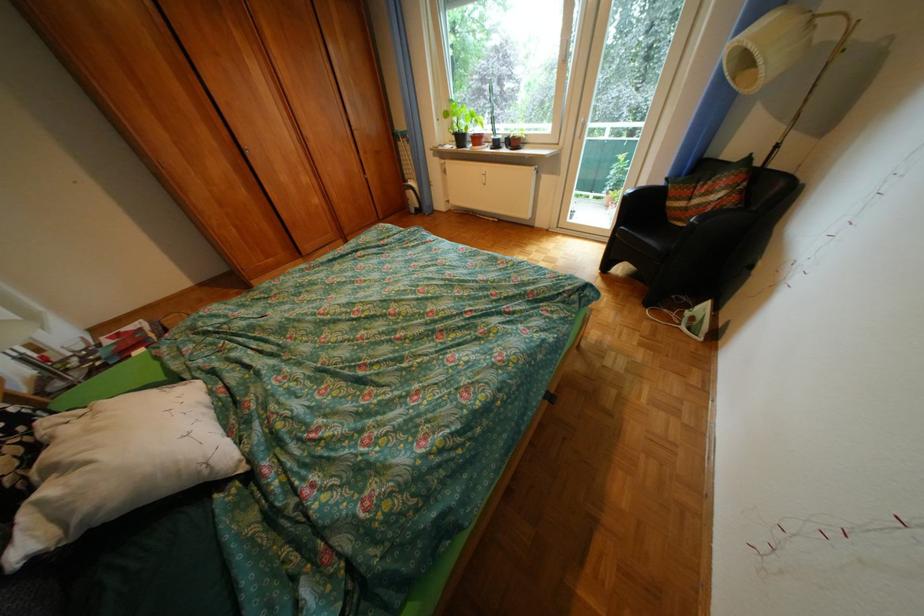
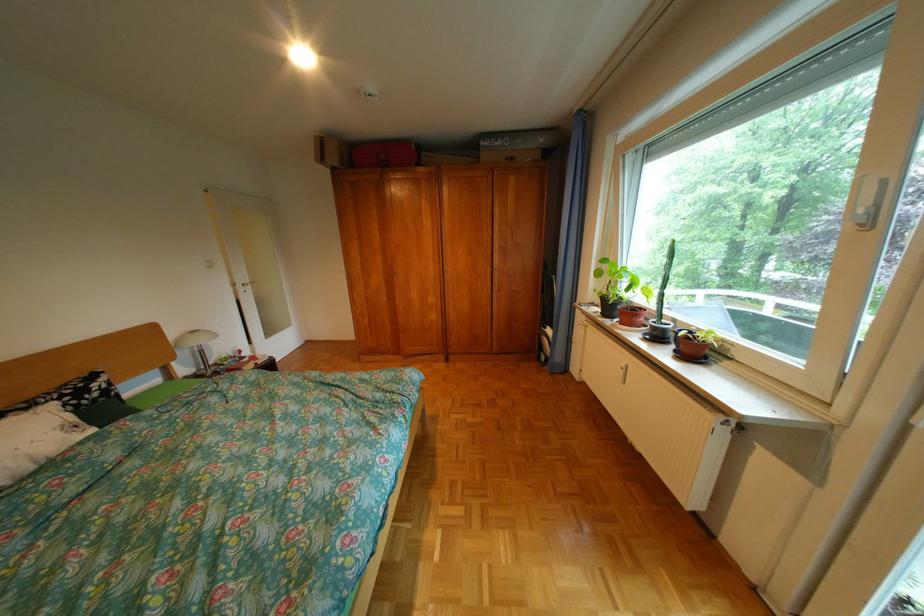
Question: I am providing you with two images of the same scene from different viewpoints. Please identify which objects are invisible in image2.

Choices:
 (A) radiator control knob
 (B) white door handle
 (C) red suitcase
 (D) none of these

Answer: (D)